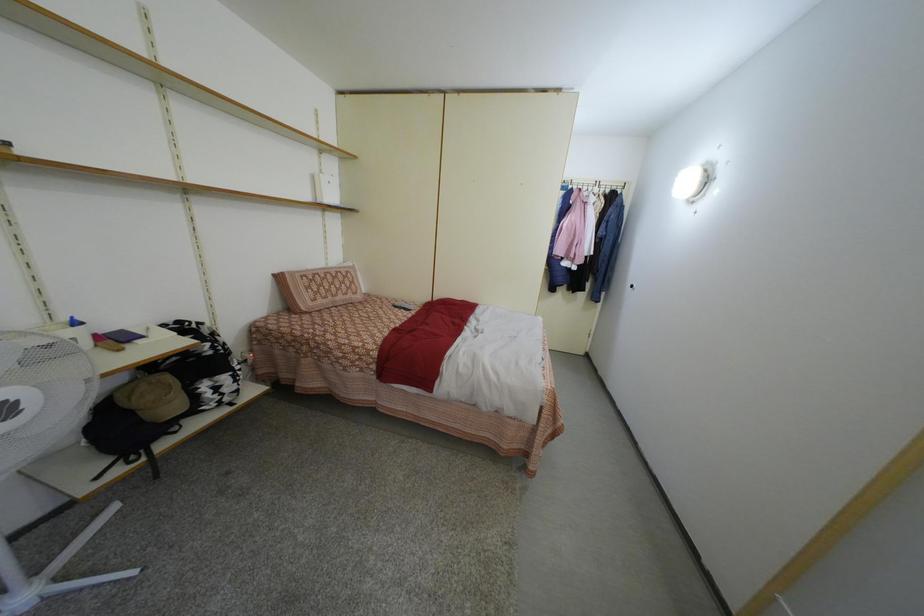
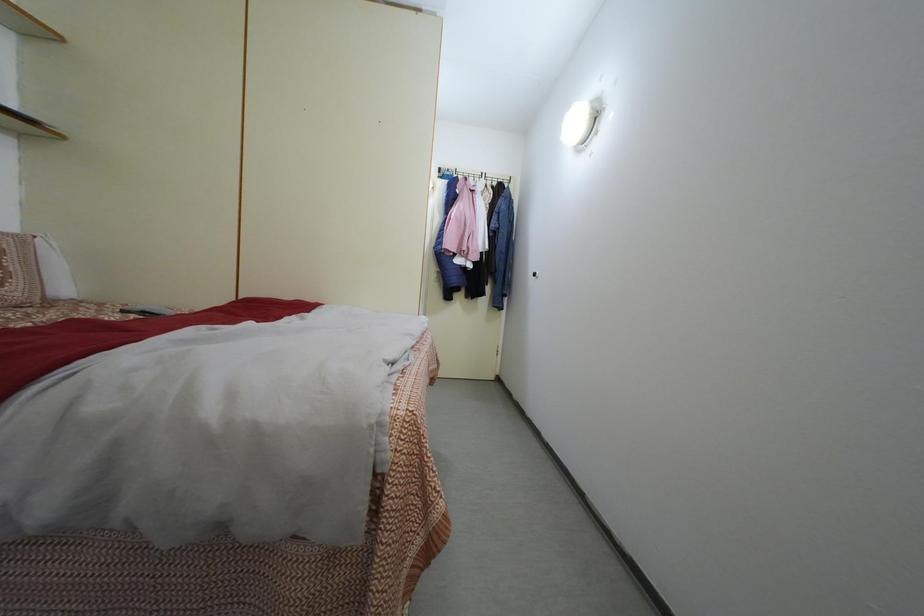
Question: The camera is either moving clockwise (left) or counter-clockwise (right) around the object. The first image is from the beginning of the video and the second image is from the end. Is the camera moving left or right when shooting the video?

Choices:
 (A) Left
 (B) Right

Answer: (A)